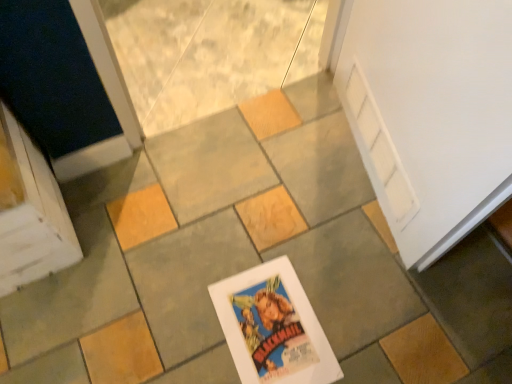
Image resolution: width=512 pixels, height=384 pixels. I want to click on free space underneath white paper picture frame at center (from a real-world perspective), so tap(269, 329).